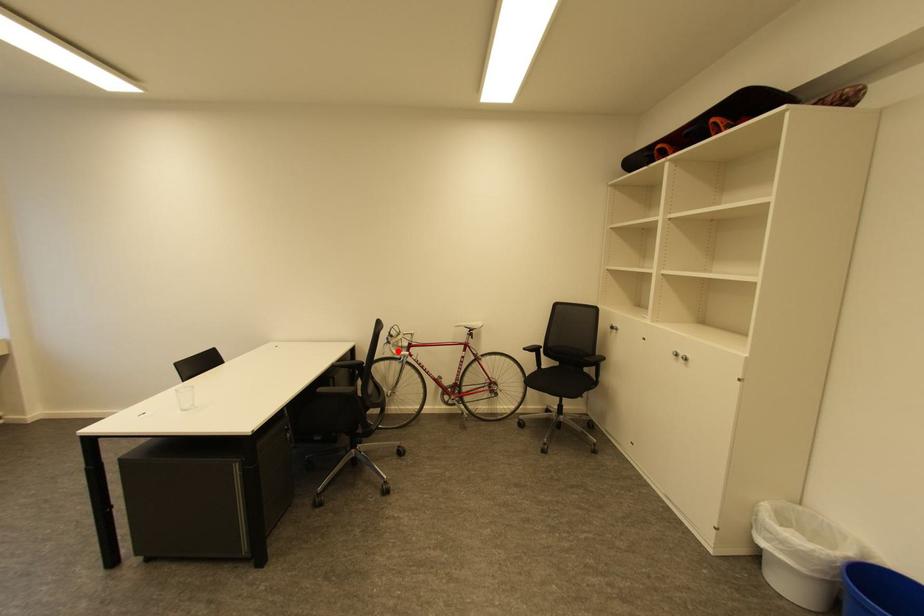
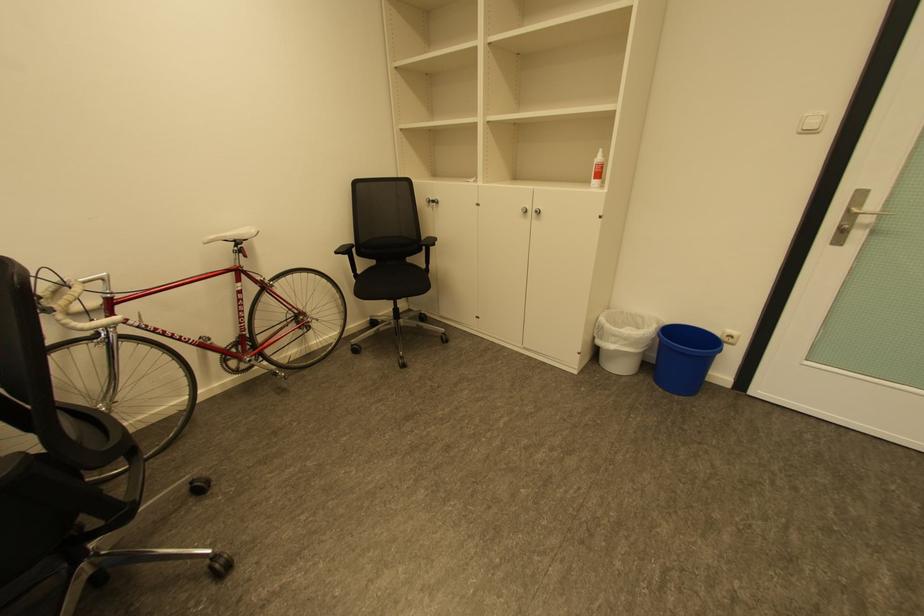
Locate, in the second image, the point that corresponds to the highlighted location in the first image.

(70, 326)